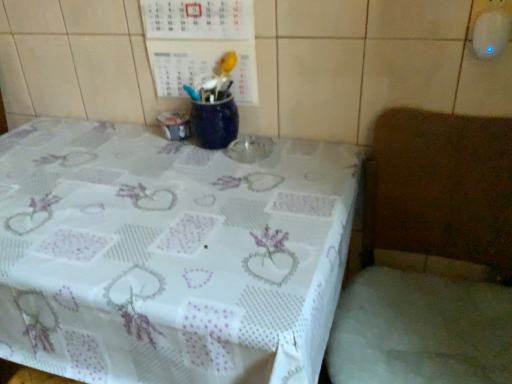
Question: Relative to wooden chair at right, is white lace tablecloth at lower right in front or behind?

Choices:
 (A) front
 (B) behind

Answer: (B)

Question: Is white lace tablecloth at lower right wider or thinner than wooden chair at right?

Choices:
 (A) wide
 (B) thin

Answer: (B)

Question: Estimate the real-world distances between objects in this image. Which object is farther from the white lace tablecloth at center?

Choices:
 (A) white lace tablecloth at lower right
 (B) wooden chair at right

Answer: (A)

Question: Estimate the real-world distances between objects in this image. Which object is farther from the white lace tablecloth at lower right?

Choices:
 (A) white lace tablecloth at center
 (B) wooden chair at right

Answer: (A)